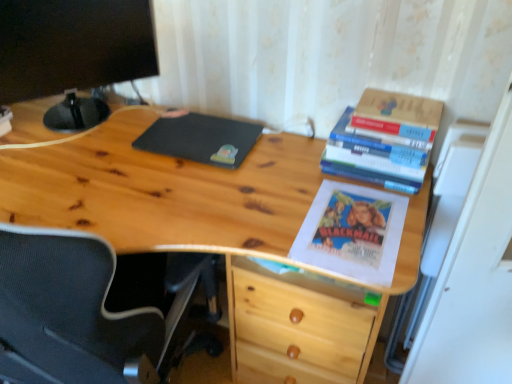
Question: From a real-world perspective, is black matte mousepad at center physically located above or below natural wood desk at center?

Choices:
 (A) below
 (B) above

Answer: (B)

Question: Is point (195, 117) positioned closer to the camera than point (157, 178)?

Choices:
 (A) farther
 (B) closer

Answer: (A)

Question: Estimate the real-world distances between objects in this image. Which object is farther from the black matte computer monitor at upper left?

Choices:
 (A) hardcover books at upper right, acting as the 2th book starting from the top
 (B) hardcover book at upper right, which is the second book in bottom-to-top order
 (C) black matte mousepad at center
 (D) natural wood desk at center

Answer: (B)

Question: Which is nearer to the black matte computer monitor at upper left?

Choices:
 (A) natural wood desk at center
 (B) hardcover books at upper right, the 1th book when ordered from bottom to top
 (C) black matte mousepad at center
 (D) hardcover book at upper right, which is the second book in bottom-to-top order

Answer: (C)